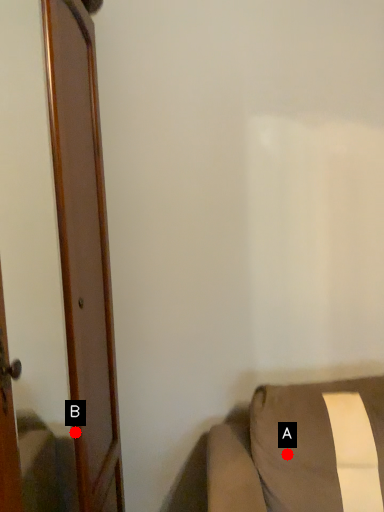
Question: Two points are circled on the image, labeled by A and B beside each circle. Which of the following is the closest to the observer?

Choices:
 (A) A is closer
 (B) B is closer

Answer: (B)